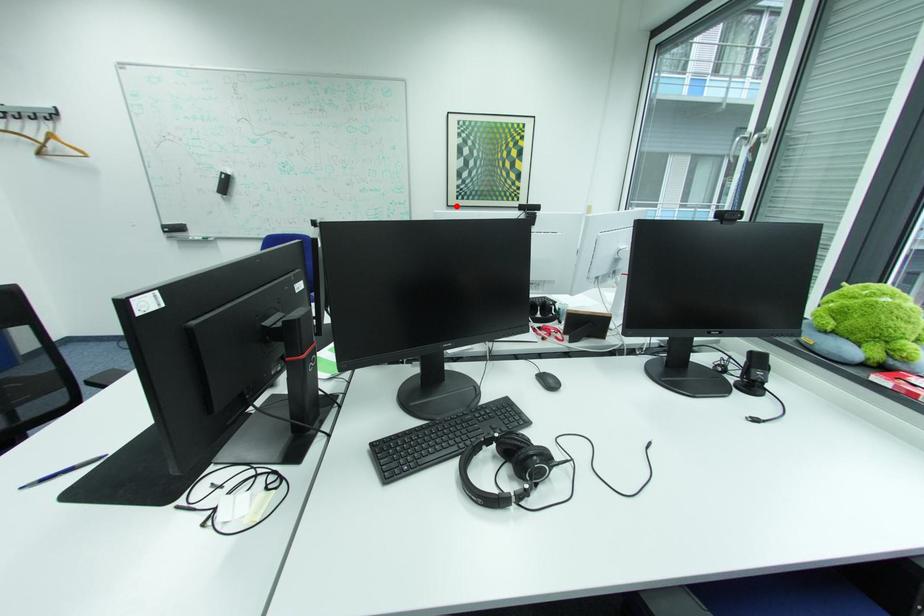
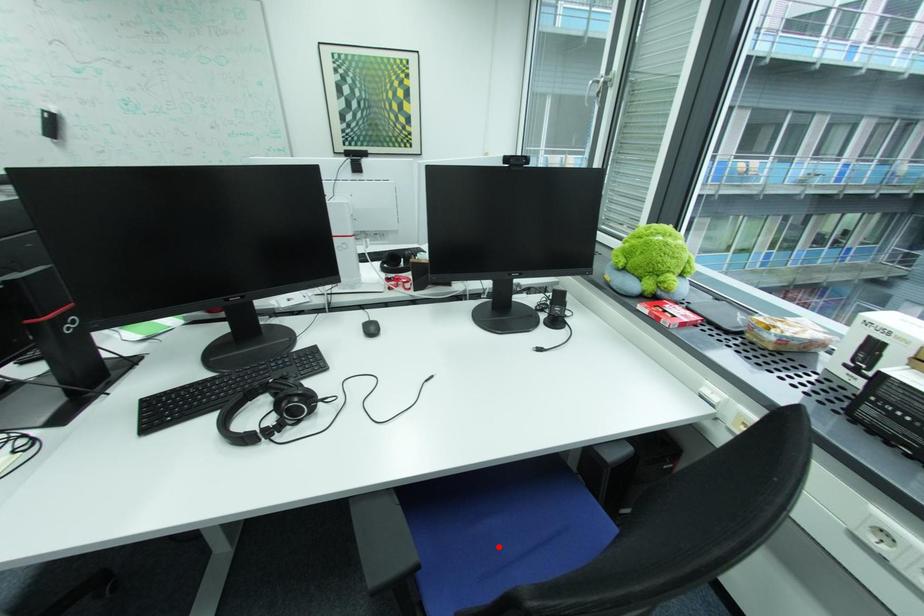
I am providing you with two images of the same scene from different viewpoints. A red point is marked on the first image and another point is marked on the second image. Do the highlighted points in image1 and image2 indicate the same real-world spot?

No